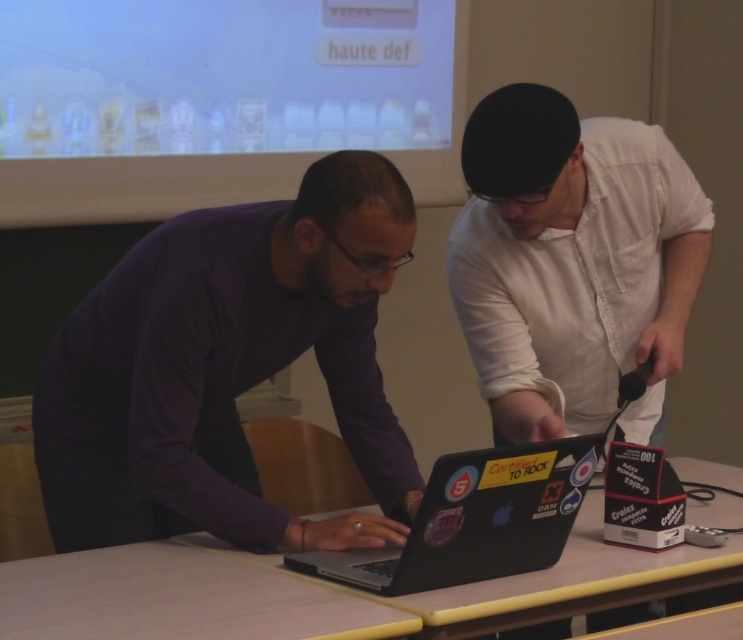
Looking at this image, is purple matte sweater at center to the right of wooden table at center from the viewer's perspective?

No, purple matte sweater at center is not to the right of wooden table at center.

Based on the photo, is purple matte sweater at center thinner than wooden table at center?

Correct, purple matte sweater at center's width is less than wooden table at center's.

Who is more forward, [221,342] or [230,605]?

Point [230,605] is more forward.

The image size is (743, 640). Identify the location of purple matte sweater at center. (227, 365).

Is white matte shirt at center to the right of wooden table at center from the viewer's perspective?

Correct, you'll find white matte shirt at center to the right of wooden table at center.

Is white matte shirt at center thinner than wooden table at center?

Yes, white matte shirt at center is thinner than wooden table at center.

Does point (528, 192) lie in front of point (721, 513)?

Yes, point (528, 192) is in front of point (721, 513).

Where is `white matte shirt at center`? The width and height of the screenshot is (743, 640). white matte shirt at center is located at coordinates (571, 260).

Is purple matte sweater at center to the right of black matte laptop at center from the viewer's perspective?

Incorrect, purple matte sweater at center is not on the right side of black matte laptop at center.

Is purple matte sweater at center wider than black matte laptop at center?

Correct, the width of purple matte sweater at center exceeds that of black matte laptop at center.

Is point (218, 209) farther from viewer compared to point (441, 545)?

Yes, it is behind point (441, 545).

At what (x,y) coordinates should I click in order to perform the action: click on purple matte sweater at center. Please return your answer as a coordinate pair (x, y). The height and width of the screenshot is (640, 743). Looking at the image, I should click on [227, 365].